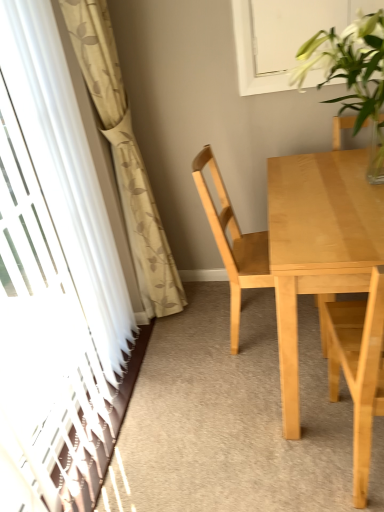
Identify the location of free space in front of light wood chair at center, marked as the 1th chair in a back-to-front arrangement. (250, 397).